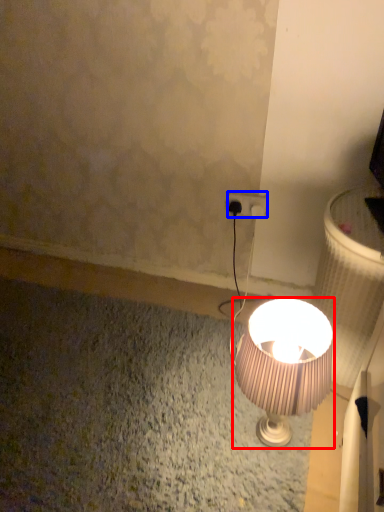
Question: Which object appears farthest to the camera in this image, lamp (highlighted by a red box) or power plugs and sockets (highlighted by a blue box)?

Choices:
 (A) lamp
 (B) power plugs and sockets

Answer: (B)